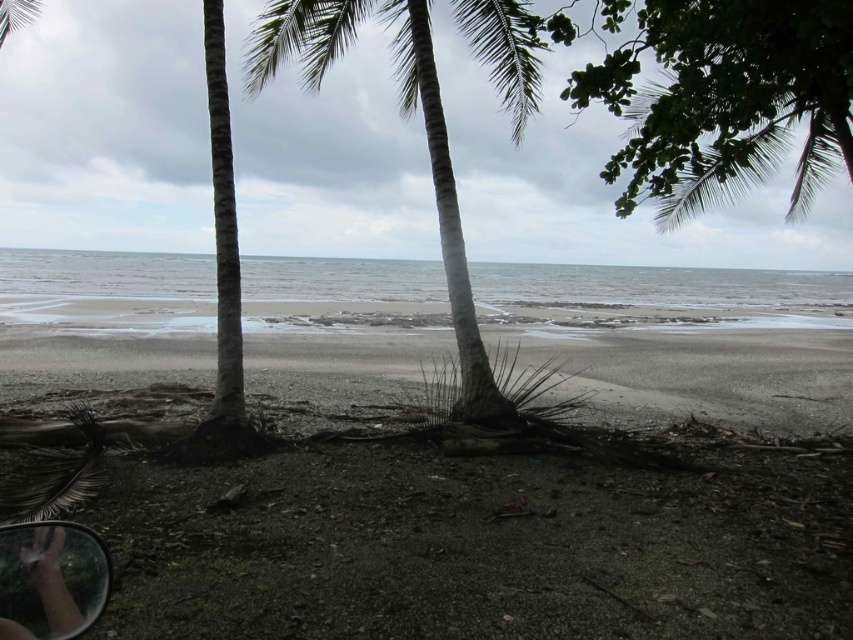
Does dark sand at center have a lesser width compared to green leafy tree at upper right?

No.

Which is behind, point (788, 531) or point (685, 45)?

The point (685, 45) is more distant.

Image resolution: width=853 pixels, height=640 pixels. What do you see at coordinates (477, 547) in the screenshot?
I see `dark sand at center` at bounding box center [477, 547].

The height and width of the screenshot is (640, 853). Find the location of `dark sand at center`. dark sand at center is located at coordinates (477, 547).

Does dark sand at center have a greater width compared to transparent glass car window at lower left?

Indeed, dark sand at center has a greater width compared to transparent glass car window at lower left.

Is dark sand at center shorter than transparent glass car window at lower left?

No, dark sand at center is not shorter than transparent glass car window at lower left.

Describe the element at coordinates (477, 547) in the screenshot. This screenshot has width=853, height=640. I see `dark sand at center` at that location.

Identify the location of dark sand at center. (477, 547).

Measure the distance from green leafy tree at upper right to transparent glass car window at lower left.

A distance of 5.58 meters exists between green leafy tree at upper right and transparent glass car window at lower left.

Between green leafy tree at upper right and transparent glass car window at lower left, which one has less height?

With less height is transparent glass car window at lower left.

Find the location of a particular element. green leafy tree at upper right is located at coordinates (720, 97).